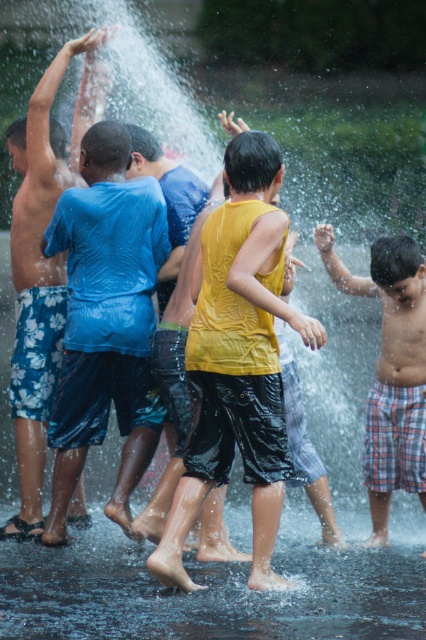
Does yellow shiny tank top at center appear over blue floral shorts at left?

No, yellow shiny tank top at center is not above blue floral shorts at left.

Measure the distance from yellow shiny tank top at center to blue floral shorts at left.

yellow shiny tank top at center is 12.38 feet from blue floral shorts at left.

At what (x,y) coordinates should I click in order to perform the action: click on yellow shiny tank top at center. Please return your answer as a coordinate pair (x, y). Looking at the image, I should click on (238, 360).

Between point (230, 326) and point (420, 428), which one is positioned behind?

Positioned behind is point (420, 428).

What do you see at coordinates (238, 360) in the screenshot?
I see `yellow shiny tank top at center` at bounding box center [238, 360].

Describe the element at coordinates (238, 360) in the screenshot. The image size is (426, 640). I see `yellow shiny tank top at center` at that location.

You are a GUI agent. You are given a task and a screenshot of the screen. Output one action in this format:
    pyautogui.click(x=<x>, y=<y>)
    Task: Click on the yellow shiny tank top at center
    
    Given the screenshot: What is the action you would take?
    pyautogui.click(x=238, y=360)

Which of these two, blue floral shorts at left or plaid shorts at right, stands taller?

blue floral shorts at left is taller.

Between blue floral shorts at left and plaid shorts at right, which one is positioned lower?

plaid shorts at right is lower down.

What do you see at coordinates (40, 268) in the screenshot? I see `blue floral shorts at left` at bounding box center [40, 268].

This screenshot has height=640, width=426. Identify the location of blue floral shorts at left. (40, 268).